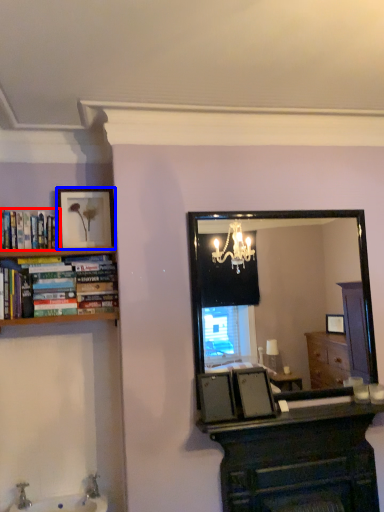
Question: Which of the following is the farthest to the observer, book (highlighted by a red box) or picture frame (highlighted by a blue box)?

Choices:
 (A) book
 (B) picture frame

Answer: (B)